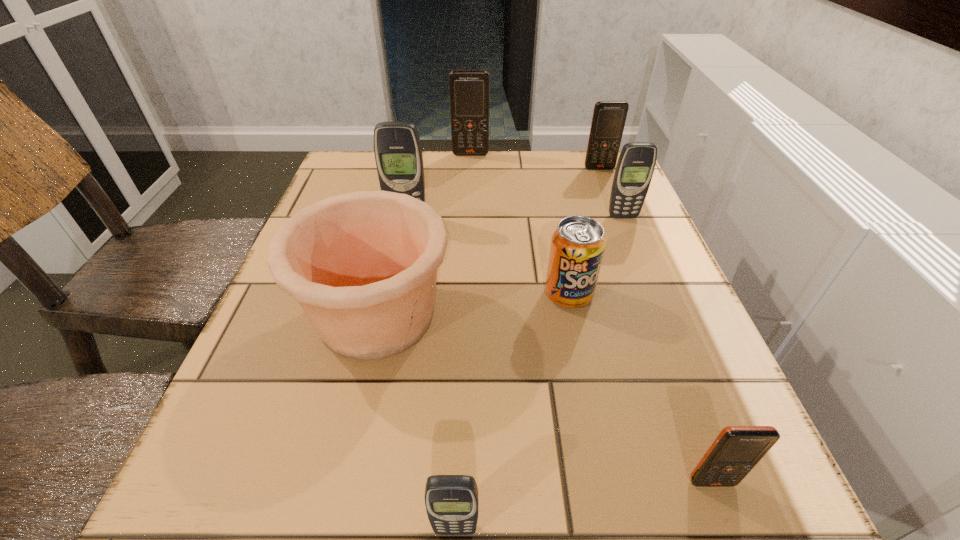
Locate an element on the screen. The width and height of the screenshot is (960, 540). the fifth farthest cellular telephone is located at coordinates (734, 453).

At what (x,y) coordinates should I click in order to perform the action: click on the smallest gray cellular telephone. Please return your answer as a coordinate pair (x, y). The height and width of the screenshot is (540, 960). Looking at the image, I should click on (451, 501).

Locate an element on the screen. the second gray cellular telephone from left to right is located at coordinates (451, 501).

Find the location of a particular element. The width and height of the screenshot is (960, 540). vacant position located on the screen of the leftmost orange cellular telephone is located at coordinates 470,169.

Where is `vacant space located on the screen of the leftmost gray cellular telephone`? The height and width of the screenshot is (540, 960). vacant space located on the screen of the leftmost gray cellular telephone is located at coordinates (381, 343).

I want to click on vacant space located 0.300m on the screen of the rightmost gray cellular telephone, so click(x=663, y=318).

This screenshot has height=540, width=960. I want to click on vacant space positioned on the screen of the second farthest object, so click(x=630, y=247).

In order to click on free region located on the back of the pottery in this screenshot , I will do `click(402, 204)`.

Identify the location of free region located on the left of the soda can. (390, 294).

In order to click on object that is at the left edge in this screenshot , I will do tap(363, 265).